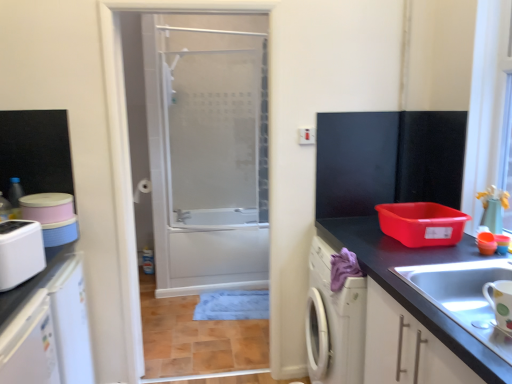
Where is `vacant space positioned to the left of white glossy mug at lower right, marked as the 2th appliance in a back-to-front arrangement`? Image resolution: width=512 pixels, height=384 pixels. vacant space positioned to the left of white glossy mug at lower right, marked as the 2th appliance in a back-to-front arrangement is located at coordinates click(449, 321).